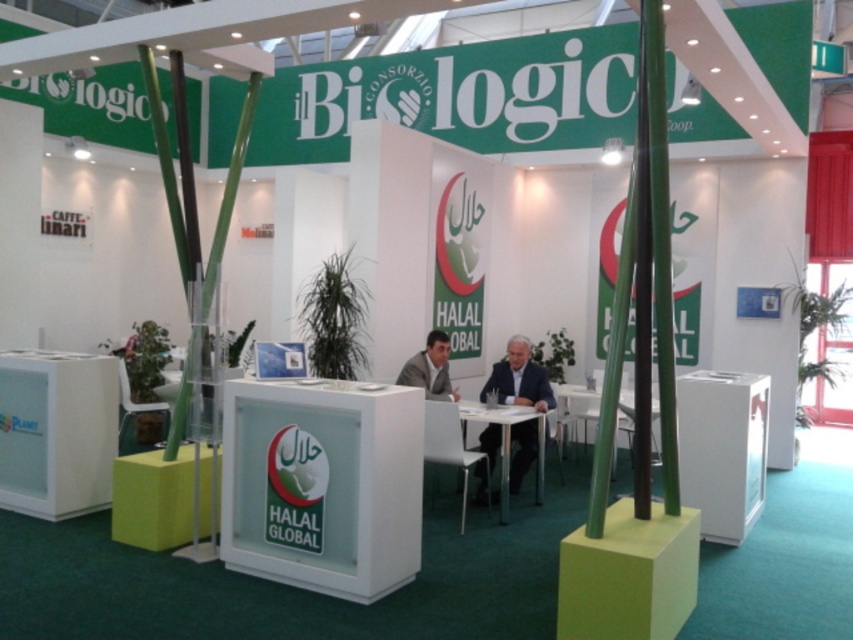
Looking at this image, you are organizing an event and need to place a 1.5 meter long banner on the table. Which table, the white glossy table at center or the white plastic table at center, can accommodate the banner without overhanging?

The white plastic table at center is larger than the white glossy table at center, so the banner can be placed on the white plastic table at center without overhanging.

You are a visitor at the exhibition and want to place a 20 inch wide promotional poster between the white glossy table at center and the white plastic table at center. Is there enough space to fit it without overlapping either table?

The distance between the white glossy table at center and the white plastic table at center is 39.11 inches. Since the poster is 20 inches wide, there is sufficient space to place it between them without overlapping either table.

You are a visitor at the exhibition and want to sit down at the white plastic table at center. Which side of the table should you approach to find the dark blue suit at center?

The dark blue suit at center is to the left of the white plastic table at center, so you should approach the left side of the table to find the dark blue suit at center.